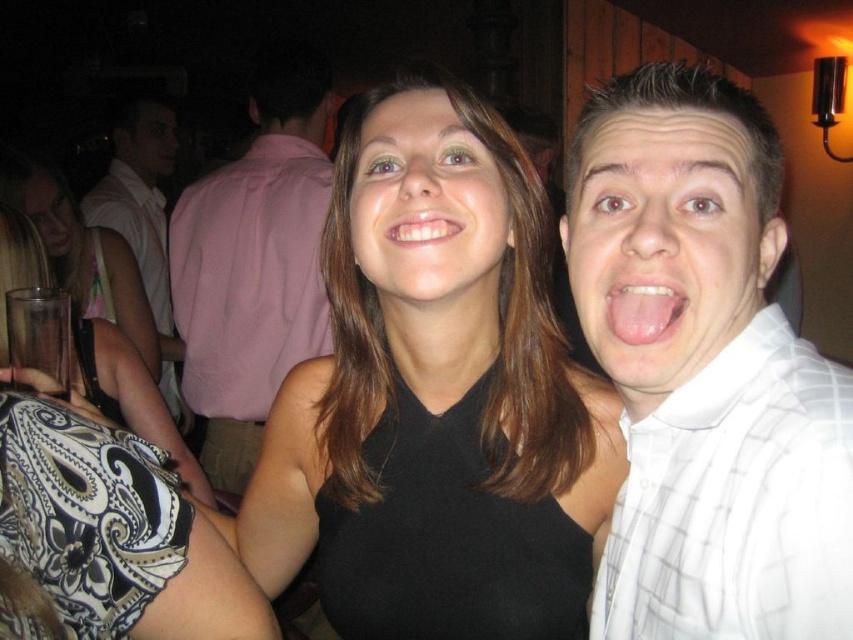
Question: Among these points, which one is nearest to the camera?

Choices:
 (A) (142, 129)
 (B) (287, 289)

Answer: (B)

Question: Is black matte face at center to the left of white shirt at left from the viewer's perspective?

Choices:
 (A) yes
 (B) no

Answer: (B)

Question: Does black matte dress at center appear over white glossy face at center right?

Choices:
 (A) no
 (B) yes

Answer: (A)

Question: Is white glossy face at center right positioned behind white glossy teeth at center?

Choices:
 (A) no
 (B) yes

Answer: (A)

Question: Which point is closer to the camera?

Choices:
 (A) pink glossy tongue at center
 (B) black matte dress at center
 (C) black matte face at center
 (D) white checkered shirt at right

Answer: (D)

Question: Which point is farther from the camera taking this photo?

Choices:
 (A) (636, 358)
 (B) (39, 170)
 (C) (300, 76)
 (D) (532, 312)

Answer: (C)